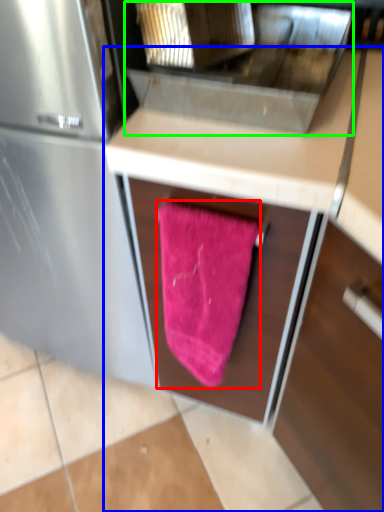
Question: Considering the real-world distances, which object is farthest from beach towel (highlighted by a red box)? cabinetry (highlighted by a blue box) or sink (highlighted by a green box)?

Choices:
 (A) cabinetry
 (B) sink

Answer: (B)